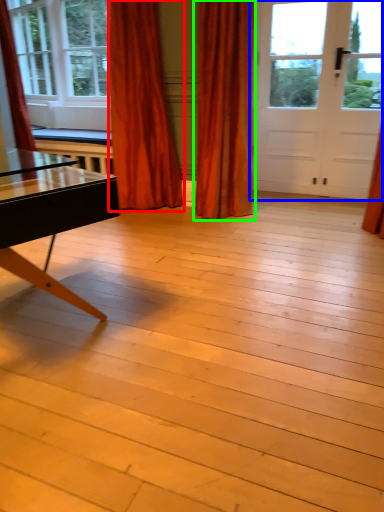
Question: Which object is positioned farthest from curtain (highlighted by a red box)? Select from door (highlighted by a blue box) and curtain (highlighted by a green box).

Choices:
 (A) door
 (B) curtain

Answer: (A)